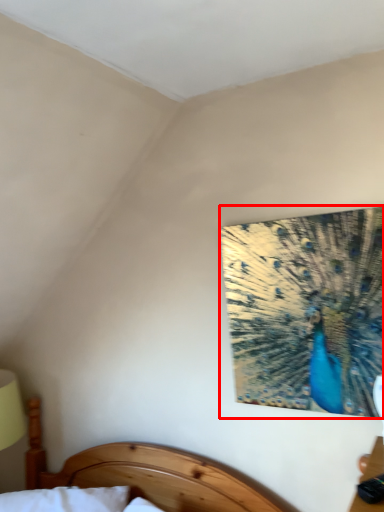
Question: Observing the image, what is the correct spatial positioning of peacock (annotated by the red box) in reference to bed?

Choices:
 (A) left
 (B) right

Answer: (B)